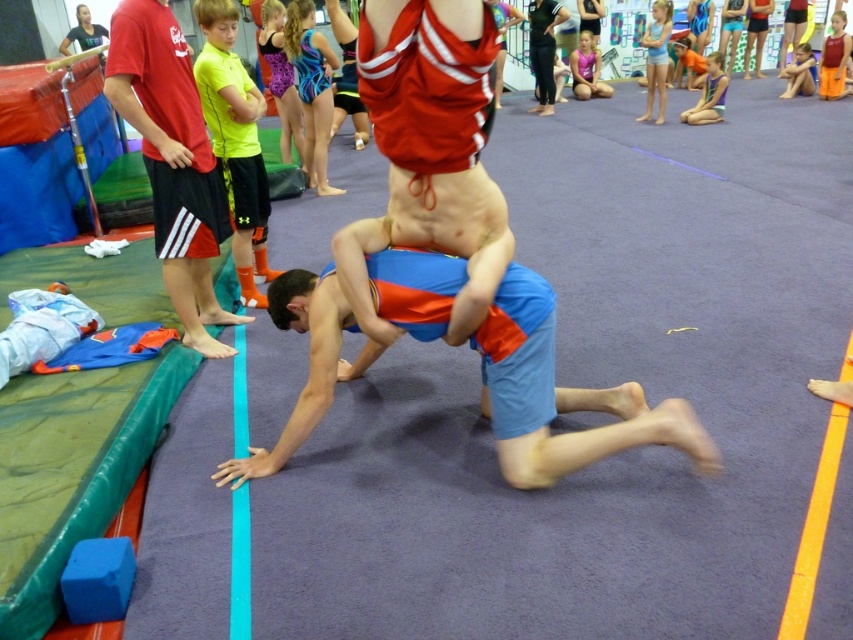
Question: Observing the image, what is the correct spatial positioning of red shirt at left in reference to yellow matte shirt at upper left?

Choices:
 (A) left
 (B) right

Answer: (A)

Question: Which of the following is the farthest from the observer?

Choices:
 (A) blue cotton shorts at center
 (B) red shirt at left

Answer: (B)

Question: Is yellow matte shirt at upper left to the left of blue shorts at lower right from the viewer's perspective?

Choices:
 (A) no
 (B) yes

Answer: (B)

Question: Is the position of blue cotton shorts at center more distant than that of yellow matte shirt at upper left?

Choices:
 (A) yes
 (B) no

Answer: (B)

Question: Among these objects, which one is nearest to the camera?

Choices:
 (A) blue cotton shorts at center
 (B) blue shorts at lower right
 (C) red shirt at left
 (D) yellow matte shirt at upper left

Answer: (A)

Question: Among these points, which one is farthest from the camera?

Choices:
 (A) (198, 212)
 (B) (509, 465)
 (C) (796, 68)
 (D) (231, 20)

Answer: (C)